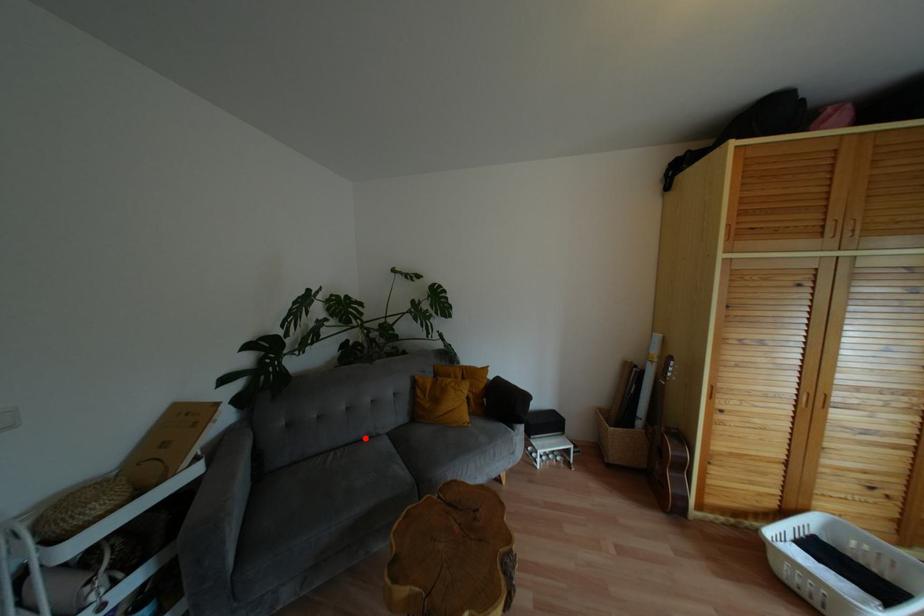
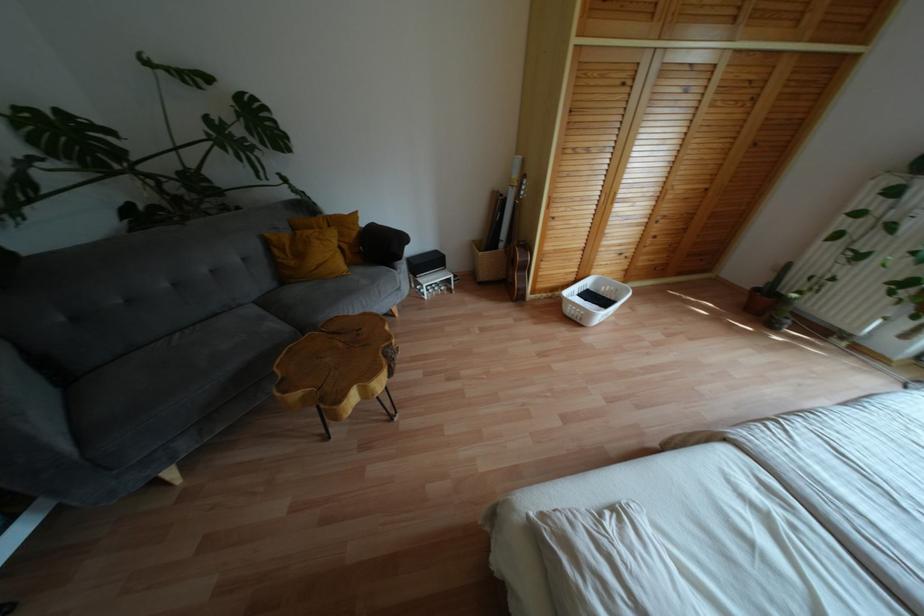
Where in the second image is the point corresponding to the highlighted location from the first image?

(224, 312)